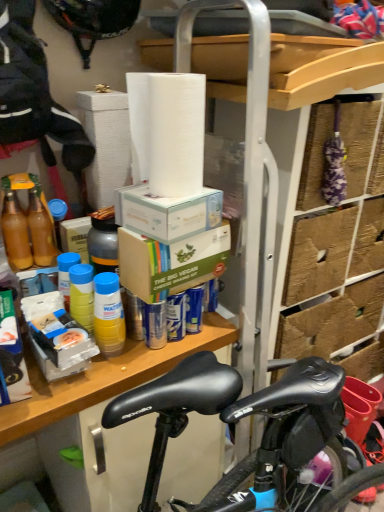
Identify the location of translucent plastic bottle at shelf center, which is the third bottle from right to left. (58, 216).

The image size is (384, 512). What do you see at coordinates (58, 216) in the screenshot?
I see `translucent plastic bottle at shelf center, which appears as the first bottle when viewed from the left` at bounding box center [58, 216].

This screenshot has height=512, width=384. What do you see at coordinates (93, 20) in the screenshot? I see `black matte helmet at upper left` at bounding box center [93, 20].

The height and width of the screenshot is (512, 384). Describe the element at coordinates (167, 213) in the screenshot. I see `white cardboard box at upper center, which is the 2th box from bottom to top` at that location.

At what (x,y) coordinates should I click in order to perform the action: click on white cardboard box at upper center, which is the 2th box from bottom to top. Please return your answer as a coordinate pair (x, y). Looking at the image, I should click on (167, 213).

From the picture: What is the approximate width of metallic silver bottle at center-left, which is the 2th bottle from right to left?

The width of metallic silver bottle at center-left, which is the 2th bottle from right to left, is 3.45 inches.

This screenshot has height=512, width=384. What do you see at coordinates (103, 245) in the screenshot?
I see `metallic silver bottle at center-left, which is the 2th bottle from right to left` at bounding box center [103, 245].

At what (x,y) coordinates should I click in order to perform the action: click on translucent plastic bottle at shelf center, which is the third bottle from right to left. Please return your answer as a coordinate pair (x, y). Looking at the image, I should click on (58, 216).

Can you tell me how much brown cardboard box at center, which appears as the second box when viewed from the top, and black matte helmet at upper left differ in facing direction?

They differ by 4.41 degrees in their facing directions.

How distant is brown cardboard box at center, which appears as the second box when viewed from the top, from black matte helmet at upper left?

brown cardboard box at center, which appears as the second box when viewed from the top, and black matte helmet at upper left are 61.37 centimeters apart.

Starting from the black matte helmet at upper left, which box is the 1st one in front? Please provide its 2D coordinates.

[(171, 262)]

Is brown cardboard box at center, the first box in the bottom-to-top sequence, taller than black matte helmet at upper left?

Result: Indeed, brown cardboard box at center, the first box in the bottom-to-top sequence, has a greater height compared to black matte helmet at upper left.

Which is correct: brown cardboard box at center, the first box in the bottom-to-top sequence, is inside yellow plastic bottle at lower left, which is counted as the 1th bottle, starting from the right, or outside of it?

brown cardboard box at center, the first box in the bottom-to-top sequence, is outside yellow plastic bottle at lower left, which is counted as the 1th bottle, starting from the right.

Looking at this image, from a real-world perspective, which is physically above, brown cardboard box at center, which appears as the second box when viewed from the top, or yellow plastic bottle at lower left, the third bottle from the left?

brown cardboard box at center, which appears as the second box when viewed from the top, from a real-world perspective.

Locate an element on the screen. the 1st bottle to the left of the brown cardboard box at center, the first box in the bottom-to-top sequence, counting from the anchor's position is located at coordinates (108, 314).

How different are the orientations of brown cardboard box at center, which appears as the second box when viewed from the top, and yellow plastic bottle at lower left, which is counted as the 1th bottle, starting from the right, in degrees?

2.94 degrees separate the facing orientations of brown cardboard box at center, which appears as the second box when viewed from the top, and yellow plastic bottle at lower left, which is counted as the 1th bottle, starting from the right.

Relative to yellow plastic bottle at lower left, the third bottle from the left, is translucent plastic bottle at shelf center, which appears as the first bottle when viewed from the left, in front or behind?

Visually, translucent plastic bottle at shelf center, which appears as the first bottle when viewed from the left, is located behind yellow plastic bottle at lower left, the third bottle from the left.

Based on the photo, is translucent plastic bottle at shelf center, which is the third bottle from right to left, positioned with its back to yellow plastic bottle at lower left, the third bottle from the left?

translucent plastic bottle at shelf center, which is the third bottle from right to left, does not have its back to yellow plastic bottle at lower left, the third bottle from the left.

In the scene shown: Does translucent plastic bottle at shelf center, which appears as the first bottle when viewed from the left, have a larger size compared to yellow plastic bottle at lower left, the third bottle from the left?

Actually, translucent plastic bottle at shelf center, which appears as the first bottle when viewed from the left, might be smaller than yellow plastic bottle at lower left, the third bottle from the left.

Would you consider translucent plastic bottle at shelf center, which appears as the first bottle when viewed from the left, to be distant from yellow plastic bottle at lower left, which is counted as the 1th bottle, starting from the right?

No, translucent plastic bottle at shelf center, which appears as the first bottle when viewed from the left, is not far away from yellow plastic bottle at lower left, which is counted as the 1th bottle, starting from the right.

Does white cardboard box at upper center, which is the first box from top to bottom, have a lesser width compared to brown cardboard box at center, the first box in the bottom-to-top sequence?

Incorrect, the width of white cardboard box at upper center, which is the first box from top to bottom, is not less than that of brown cardboard box at center, the first box in the bottom-to-top sequence.

Considering the sizes of objects white cardboard box at upper center, which is the 2th box from bottom to top, and brown cardboard box at center, the first box in the bottom-to-top sequence, in the image provided, who is taller, white cardboard box at upper center, which is the 2th box from bottom to top, or brown cardboard box at center, the first box in the bottom-to-top sequence,?

Standing taller between the two is brown cardboard box at center, the first box in the bottom-to-top sequence.

Image resolution: width=384 pixels, height=512 pixels. What are the coordinates of `box in front of the brown cardboard box at center, which appears as the second box when viewed from the top` in the screenshot? It's located at pyautogui.click(x=167, y=213).

Considering the positions of objects white cardboard box at upper center, which is the 2th box from bottom to top, and brown cardboard box at center, which appears as the second box when viewed from the top, in the image provided, who is behind, white cardboard box at upper center, which is the 2th box from bottom to top, or brown cardboard box at center, which appears as the second box when viewed from the top,?

brown cardboard box at center, which appears as the second box when viewed from the top, is more distant.

Find the location of a particular element. This screenshot has width=384, height=512. the 2nd box counting from the right of the wooden shelf at center is located at coordinates (171, 262).

Which of these two, wooden shelf at center or brown cardboard box at center, the first box in the bottom-to-top sequence, is thinner?

brown cardboard box at center, the first box in the bottom-to-top sequence.

Could you measure the distance between wooden shelf at center and brown cardboard box at center, which appears as the second box when viewed from the top?

The distance of wooden shelf at center from brown cardboard box at center, which appears as the second box when viewed from the top, is 8.01 inches.

In terms of height, does wooden shelf at center look taller or shorter compared to brown cardboard box at center, which appears as the second box when viewed from the top?

wooden shelf at center is taller than brown cardboard box at center, which appears as the second box when viewed from the top.

Is white cardboard box at upper center, which is the 2th box from bottom to top, at the left side of yellow plastic bottle at lower left, the third bottle from the left?

In fact, white cardboard box at upper center, which is the 2th box from bottom to top, is to the right of yellow plastic bottle at lower left, the third bottle from the left.

Is point (184, 231) positioned behind point (118, 295)?

No, (184, 231) is in front of (118, 295).

Between white cardboard box at upper center, which is the 2th box from bottom to top, and yellow plastic bottle at lower left, the third bottle from the left, which one has larger width?

Wider between the two is white cardboard box at upper center, which is the 2th box from bottom to top.

Is metallic silver bottle at center-left, which ranks as the 2th bottle in left-to-right order, turned away from yellow plastic bottle at lower left, which is counted as the 1th bottle, starting from the right?

No, metallic silver bottle at center-left, which ranks as the 2th bottle in left-to-right order, is not facing away from yellow plastic bottle at lower left, which is counted as the 1th bottle, starting from the right.

From a real-world perspective, is metallic silver bottle at center-left, which ranks as the 2th bottle in left-to-right order, over yellow plastic bottle at lower left, the third bottle from the left?

Correct, in the physical world, metallic silver bottle at center-left, which ranks as the 2th bottle in left-to-right order, is higher than yellow plastic bottle at lower left, the third bottle from the left.

In terms of width, does metallic silver bottle at center-left, which is the 2th bottle from right to left, look wider or thinner when compared to yellow plastic bottle at lower left, the third bottle from the left?

metallic silver bottle at center-left, which is the 2th bottle from right to left, is wider than yellow plastic bottle at lower left, the third bottle from the left.

Find the location of a particular element. The height and width of the screenshot is (512, 384). bicycle helmet lying above the brown cardboard box at center, the first box in the bottom-to-top sequence (from the image's perspective) is located at coordinates (93, 20).

Where is `box that is the 1st object above the yellow plastic bottle at lower left, the third bottle from the left (from a real-world perspective)`? The width and height of the screenshot is (384, 512). box that is the 1st object above the yellow plastic bottle at lower left, the third bottle from the left (from a real-world perspective) is located at coordinates (171, 262).

Which object lies nearer to the anchor point yellow plastic bottle at lower left, the third bottle from the left, wooden shelf at center or translucent plastic bottle at shelf center, which is the third bottle from right to left?

wooden shelf at center is closer to yellow plastic bottle at lower left, the third bottle from the left.

Estimate the real-world distances between objects in this image. Which object is further from wooden shelf at center, brown cardboard box at center, the first box in the bottom-to-top sequence, or yellow plastic bottle at lower left, the third bottle from the left?

brown cardboard box at center, the first box in the bottom-to-top sequence, lies further to wooden shelf at center than the other object.

Based on their spatial positions, is metallic silver bottle at center-left, which is the 2th bottle from right to left, or translucent plastic bottle at shelf center, which appears as the first bottle when viewed from the left, further from black matte helmet at upper left?

metallic silver bottle at center-left, which is the 2th bottle from right to left, is further to black matte helmet at upper left.

Looking at the image, which one is located closer to black matte helmet at upper left, wooden shelf at center or white matte paper towel at upper center?

Among the two, white matte paper towel at upper center is located nearer to black matte helmet at upper left.

Considering their positions, is metallic silver bottle at center-left, which ranks as the 2th bottle in left-to-right order, positioned closer to translucent plastic bottle at shelf center, which appears as the first bottle when viewed from the left, than wooden shelf at center?

metallic silver bottle at center-left, which ranks as the 2th bottle in left-to-right order.

Based on their spatial positions, is metallic silver bottle at center-left, which is the 2th bottle from right to left, or wooden shelf at center closer to black matte helmet at upper left?

metallic silver bottle at center-left, which is the 2th bottle from right to left.

Which object lies further to the anchor point metallic silver bottle at center-left, which ranks as the 2th bottle in left-to-right order, wooden shelf at center or yellow plastic bottle at lower left, the third bottle from the left?

Among the two, wooden shelf at center is located further to metallic silver bottle at center-left, which ranks as the 2th bottle in left-to-right order.

Estimate the real-world distances between objects in this image. Which object is further from white matte paper towel at upper center, yellow plastic bottle at lower left, the third bottle from the left, or metallic silver bottle at center-left, which is the 2th bottle from right to left?

yellow plastic bottle at lower left, the third bottle from the left.

Find the location of `box that lies between black matte helmet at upper left and translucent plastic bottle at shelf center, which is the third bottle from right to left, from top to bottom`. box that lies between black matte helmet at upper left and translucent plastic bottle at shelf center, which is the third bottle from right to left, from top to bottom is located at coordinates (167, 213).

This screenshot has height=512, width=384. In order to click on paper towel located between translucent plastic bottle at shelf center, which is the third bottle from right to left, and white cardboard box at upper center, which is the 2th box from bottom to top, in the left-right direction in this screenshot , I will do `click(167, 131)`.

Find the location of a particular element. The width and height of the screenshot is (384, 512). paper towel located between translucent plastic bottle at shelf center, which appears as the first bottle when viewed from the left, and brown cardboard box at center, which appears as the second box when viewed from the top, in the left-right direction is located at coordinates (167, 131).

Find the location of a particular element. The height and width of the screenshot is (512, 384). box between black matte helmet at upper left and metallic silver bottle at center-left, which ranks as the 2th bottle in left-to-right order, in the vertical direction is located at coordinates (167, 213).